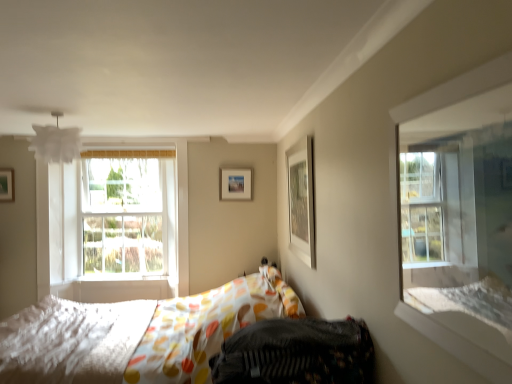
Question: Is clear glass window at upper right at the left side of matte white picture frame at upper left, acting as the second picture frame starting from the front?

Choices:
 (A) yes
 (B) no

Answer: (B)

Question: Does clear glass window at upper right have a greater height compared to matte white picture frame at upper left, the 2th picture frame in the back-to-front sequence?

Choices:
 (A) no
 (B) yes

Answer: (B)

Question: Does clear glass window at upper right touch matte white picture frame at upper left, which is the 3th picture frame from right to left?

Choices:
 (A) yes
 (B) no

Answer: (B)

Question: Considering the relative sizes of clear glass window at upper right and matte white picture frame at upper left, which is the 3th picture frame from right to left, in the image provided, is clear glass window at upper right thinner than matte white picture frame at upper left, which is the 3th picture frame from right to left,?

Choices:
 (A) no
 (B) yes

Answer: (A)

Question: Is clear glass window at upper right bigger than matte white picture frame at upper left, placed as the 1th picture frame when sorted from left to right?

Choices:
 (A) no
 (B) yes

Answer: (B)

Question: Is the depth of clear glass window at upper right less than that of matte white picture frame at upper left, the 2th picture frame in the back-to-front sequence?

Choices:
 (A) no
 (B) yes

Answer: (B)

Question: Is matte wooden picture frame at center, placed as the third picture frame when sorted from front to back, closer to camera compared to white textured mattress at lower left?

Choices:
 (A) no
 (B) yes

Answer: (A)

Question: Is matte wooden picture frame at center, placed as the third picture frame when sorted from front to back, to the left of white textured mattress at lower left from the viewer's perspective?

Choices:
 (A) yes
 (B) no

Answer: (B)

Question: Is matte wooden picture frame at center, which appears as the 1th picture frame when viewed from the back, next to white textured mattress at lower left and touching it?

Choices:
 (A) yes
 (B) no

Answer: (B)

Question: Considering the relative sizes of matte wooden picture frame at center, the 2th picture frame viewed from the left, and white textured mattress at lower left in the image provided, is matte wooden picture frame at center, the 2th picture frame viewed from the left, smaller than white textured mattress at lower left?

Choices:
 (A) yes
 (B) no

Answer: (A)

Question: Is matte wooden picture frame at center, which appears as the 1th picture frame when viewed from the back, to the right of white textured mattress at lower left from the viewer's perspective?

Choices:
 (A) yes
 (B) no

Answer: (A)

Question: From the image's perspective, does matte wooden picture frame at center, which appears as the 1th picture frame when viewed from the back, appear higher than white textured mattress at lower left?

Choices:
 (A) yes
 (B) no

Answer: (A)

Question: Considering the relative sizes of clear glass window at upper right and patterned fabric bed at center in the image provided, is clear glass window at upper right smaller than patterned fabric bed at center?

Choices:
 (A) no
 (B) yes

Answer: (B)